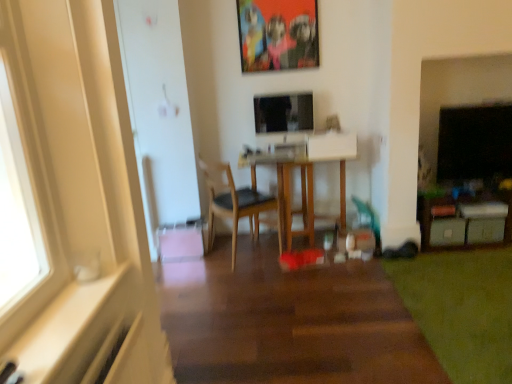
The width and height of the screenshot is (512, 384). What do you see at coordinates (278, 34) in the screenshot?
I see `matte plastic picture frame at upper center` at bounding box center [278, 34].

You are a GUI agent. You are given a task and a screenshot of the screen. Output one action in this format:
    pyautogui.click(x=<x>, y=<y>)
    Task: Click on the wooden chair at center
    The width and height of the screenshot is (512, 384).
    Given the screenshot: What is the action you would take?
    pyautogui.click(x=236, y=203)

In order to click on wooden table at center in this screenshot , I will do `click(306, 180)`.

Where is `matte plastic picture frame at upper center`? The width and height of the screenshot is (512, 384). matte plastic picture frame at upper center is located at coordinates (278, 34).

Considering the points (311, 101) and (297, 48), which point is in front, point (311, 101) or point (297, 48)?

Point (297, 48)

Is satin black monitor at center not near matte plastic picture frame at upper center?

satin black monitor at center is actually quite close to matte plastic picture frame at upper center.

This screenshot has height=384, width=512. I want to click on picture frame above the satin black monitor at center (from a real-world perspective), so pyautogui.click(x=278, y=34).

In the image, is satin black monitor at center positioned in front of or behind matte plastic picture frame at upper center?

Clearly, satin black monitor at center is behind matte plastic picture frame at upper center.

From a real-world perspective, is green matte drawer at lower right, which ranks as the first drawer in left-to-right order, physically located above or below green soft carpet at lower right?

green matte drawer at lower right, which ranks as the first drawer in left-to-right order, is situated higher than green soft carpet at lower right in the real world.

Would you say green soft carpet at lower right is part of green matte drawer at lower right, acting as the 2th drawer starting from the right,'s contents?

That's incorrect, green soft carpet at lower right is not inside green matte drawer at lower right, acting as the 2th drawer starting from the right.

Can you see green matte drawer at lower right, acting as the 2th drawer starting from the right, touching green soft carpet at lower right?

No, green matte drawer at lower right, acting as the 2th drawer starting from the right, is not next to green soft carpet at lower right.

Is green matte drawer at lower right, which ranks as the first drawer in left-to-right order, in front of or behind green soft carpet at lower right in the image?

green matte drawer at lower right, which ranks as the first drawer in left-to-right order, is positioned farther from the viewer than green soft carpet at lower right.

From the image's perspective, which is below, wooden table at center or matte plastic picture frame at upper center?

wooden table at center is shown below in the image.

Can you confirm if wooden table at center is smaller than matte plastic picture frame at upper center?

Actually, wooden table at center might be larger than matte plastic picture frame at upper center.

Which object is more forward, wooden table at center or matte plastic picture frame at upper center?

wooden table at center.

Based on the photo, does wooden table at center have a lesser height compared to matte plastic picture frame at upper center?

In fact, wooden table at center may be taller than matte plastic picture frame at upper center.

Identify the location of picture frame above the green soft carpet at lower right (from the image's perspective). The image size is (512, 384). (278, 34).

From the picture: Considering the relative sizes of matte plastic picture frame at upper center and green soft carpet at lower right in the image provided, is matte plastic picture frame at upper center bigger than green soft carpet at lower right?

Actually, matte plastic picture frame at upper center might be smaller than green soft carpet at lower right.

Is matte plastic picture frame at upper center turned away from green soft carpet at lower right?

No, matte plastic picture frame at upper center is not facing away from green soft carpet at lower right.

Can you confirm if matte plastic picture frame at upper center is positioned to the left of green soft carpet at lower right?

Indeed, matte plastic picture frame at upper center is positioned on the left side of green soft carpet at lower right.

Can you confirm if wooden table at center is thinner than green soft carpet at lower right?

Correct, the width of wooden table at center is less than that of green soft carpet at lower right.

From the image's perspective, is wooden table at center over green soft carpet at lower right?

Yes.

Are wooden table at center and green soft carpet at lower right making contact?

No, wooden table at center is not with green soft carpet at lower right.

Who is more distant, wooden table at center or green soft carpet at lower right?

wooden table at center is behind.

Considering the sizes of green soft carpet at lower right and white plastic drawer at lower right, the 2th drawer when ordered from left to right, in the image, is green soft carpet at lower right bigger or smaller than white plastic drawer at lower right, the 2th drawer when ordered from left to right,?

green soft carpet at lower right is bigger than white plastic drawer at lower right, the 2th drawer when ordered from left to right.

From the image's perspective, which one is positioned lower, green soft carpet at lower right or white plastic drawer at lower right, the 2th drawer when ordered from left to right?

green soft carpet at lower right is shown below in the image.

From the image's perspective, which one is positioned lower, green matte drawer at lower right, which ranks as the first drawer in left-to-right order, or white plastic drawer at lower right, the 2th drawer when ordered from left to right?

green matte drawer at lower right, which ranks as the first drawer in left-to-right order.

Is green matte drawer at lower right, which ranks as the first drawer in left-to-right order, wider or thinner than white plastic drawer at lower right, the 1th drawer in the right-to-left sequence?

Clearly, green matte drawer at lower right, which ranks as the first drawer in left-to-right order, has less width compared to white plastic drawer at lower right, the 1th drawer in the right-to-left sequence.

Which object is further away from the camera, green matte drawer at lower right, acting as the 2th drawer starting from the right, or white plastic drawer at lower right, the 2th drawer when ordered from left to right?

green matte drawer at lower right, acting as the 2th drawer starting from the right, is further away from the camera.

Considering the relative sizes of green matte drawer at lower right, which ranks as the first drawer in left-to-right order, and white plastic drawer at lower right, the 2th drawer when ordered from left to right, in the image provided, is green matte drawer at lower right, which ranks as the first drawer in left-to-right order, bigger than white plastic drawer at lower right, the 2th drawer when ordered from left to right,?

Correct, green matte drawer at lower right, which ranks as the first drawer in left-to-right order, is larger in size than white plastic drawer at lower right, the 2th drawer when ordered from left to right.

Image resolution: width=512 pixels, height=384 pixels. I want to click on picture frame above the satin black monitor at center (from the image's perspective), so click(278, 34).

Identify the location of the 1st drawer to the right when counting from the green soft carpet at lower right. This screenshot has height=384, width=512. (447, 232).

Estimate the real-world distances between objects in this image. Which object is further from satin black monitor at center, matte plastic picture frame at upper center or green matte drawer at lower right, which ranks as the first drawer in left-to-right order?

Based on the image, green matte drawer at lower right, which ranks as the first drawer in left-to-right order, appears to be further to satin black monitor at center.

Based on their spatial positions, is green matte drawer at lower right, acting as the 2th drawer starting from the right, or wooden chair at center closer to green soft carpet at lower right?

green matte drawer at lower right, acting as the 2th drawer starting from the right, is positioned closer to the anchor green soft carpet at lower right.

Considering their positions, is satin black monitor at center positioned closer to white plastic drawer at lower right, the 2th drawer when ordered from left to right, than wooden chair at center?

satin black monitor at center is closer to white plastic drawer at lower right, the 2th drawer when ordered from left to right.

Based on their spatial positions, is green soft carpet at lower right or green matte drawer at lower right, which ranks as the first drawer in left-to-right order, further from wooden chair at center?

green matte drawer at lower right, which ranks as the first drawer in left-to-right order, lies further to wooden chair at center than the other object.

Based on their spatial positions, is green matte drawer at lower right, which ranks as the first drawer in left-to-right order, or green soft carpet at lower right further from matte plastic picture frame at upper center?

Based on the image, green soft carpet at lower right appears to be further to matte plastic picture frame at upper center.

Looking at the image, which one is located further to green soft carpet at lower right, satin black monitor at center or green matte drawer at lower right, acting as the 2th drawer starting from the right?

satin black monitor at center is further to green soft carpet at lower right.

Looking at the image, which one is located further to matte plastic picture frame at upper center, green matte drawer at lower right, which ranks as the first drawer in left-to-right order, or wooden table at center?

green matte drawer at lower right, which ranks as the first drawer in left-to-right order, is positioned further to the anchor matte plastic picture frame at upper center.

When comparing their distances from white plastic drawer at lower right, the 2th drawer when ordered from left to right, does green matte drawer at lower right, acting as the 2th drawer starting from the right, or matte plastic picture frame at upper center seem closer?

green matte drawer at lower right, acting as the 2th drawer starting from the right.

Locate an element on the screen. drawer between satin black monitor at center and white plastic drawer at lower right, the 2th drawer when ordered from left to right is located at coordinates (447, 232).

Locate an element on the screen. picture frame situated between wooden chair at center and white plastic drawer at lower right, the 1th drawer in the right-to-left sequence, from left to right is located at coordinates (278, 34).

The height and width of the screenshot is (384, 512). Find the location of `table between matte plastic picture frame at upper center and green matte drawer at lower right, acting as the 2th drawer starting from the right, in the vertical direction`. table between matte plastic picture frame at upper center and green matte drawer at lower right, acting as the 2th drawer starting from the right, in the vertical direction is located at coordinates (306, 180).

The width and height of the screenshot is (512, 384). I want to click on chair between matte plastic picture frame at upper center and green matte drawer at lower right, which ranks as the first drawer in left-to-right order, vertically, so click(236, 203).